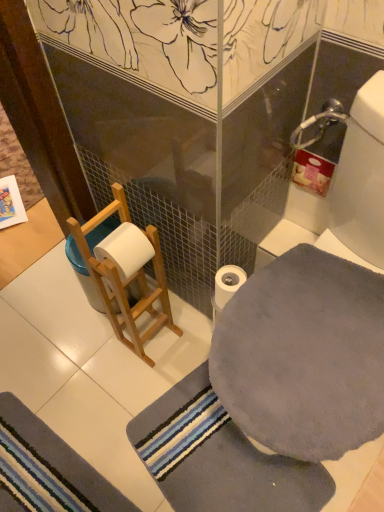
Question: Is gray soft bath towel at lower right, positioned as the 2th bath towel in top-to-bottom order, turned away from gray plush bath mat at lower left?

Choices:
 (A) yes
 (B) no

Answer: (B)

Question: From the image's perspective, is gray soft bath towel at lower right, positioned as the 2th bath towel in top-to-bottom order, on gray plush bath mat at lower left?

Choices:
 (A) yes
 (B) no

Answer: (A)

Question: Can you see gray soft bath towel at lower right, arranged as the first bath towel when ordered from the bottom, touching gray plush bath mat at lower left?

Choices:
 (A) yes
 (B) no

Answer: (B)

Question: Is gray soft bath towel at lower right, positioned as the 2th bath towel in top-to-bottom order, aimed at gray plush bath mat at lower left?

Choices:
 (A) no
 (B) yes

Answer: (B)

Question: Is gray soft bath towel at lower right, arranged as the first bath towel when ordered from the bottom, smaller than gray plush bath mat at lower left?

Choices:
 (A) yes
 (B) no

Answer: (B)

Question: Would you say gray soft bath towel at lower right, arranged as the first bath towel when ordered from the bottom, contains gray plush bath mat at lower left?

Choices:
 (A) no
 (B) yes

Answer: (A)

Question: Considering the relative sizes of white matte toilet paper at center and gray soft bath towel at lower right, positioned as the 2th bath towel in top-to-bottom order, in the image provided, is white matte toilet paper at center smaller than gray soft bath towel at lower right, positioned as the 2th bath towel in top-to-bottom order,?

Choices:
 (A) yes
 (B) no

Answer: (A)

Question: Is white matte toilet paper at center aimed at gray soft bath towel at lower right, positioned as the 2th bath towel in top-to-bottom order?

Choices:
 (A) yes
 (B) no

Answer: (B)

Question: Considering the relative positions of white matte toilet paper at center and gray soft bath towel at lower right, positioned as the 2th bath towel in top-to-bottom order, in the image provided, is white matte toilet paper at center to the right of gray soft bath towel at lower right, positioned as the 2th bath towel in top-to-bottom order, from the viewer's perspective?

Choices:
 (A) yes
 (B) no

Answer: (A)

Question: Considering the relative positions of white matte toilet paper at center and gray soft bath towel at lower right, arranged as the first bath towel when ordered from the bottom, in the image provided, is white matte toilet paper at center behind gray soft bath towel at lower right, arranged as the first bath towel when ordered from the bottom,?

Choices:
 (A) no
 (B) yes

Answer: (B)

Question: From the image's perspective, is white matte toilet paper at center below gray soft bath towel at lower right, positioned as the 2th bath towel in top-to-bottom order?

Choices:
 (A) yes
 (B) no

Answer: (B)

Question: Considering the relative sizes of white matte toilet paper at center and gray soft bath towel at lower right, positioned as the 2th bath towel in top-to-bottom order, in the image provided, is white matte toilet paper at center taller than gray soft bath towel at lower right, positioned as the 2th bath towel in top-to-bottom order,?

Choices:
 (A) no
 (B) yes

Answer: (B)

Question: Can you confirm if gray soft bath towel at lower right, arranged as the first bath towel when ordered from the bottom, is wider than white matte toilet paper at center?

Choices:
 (A) no
 (B) yes

Answer: (B)